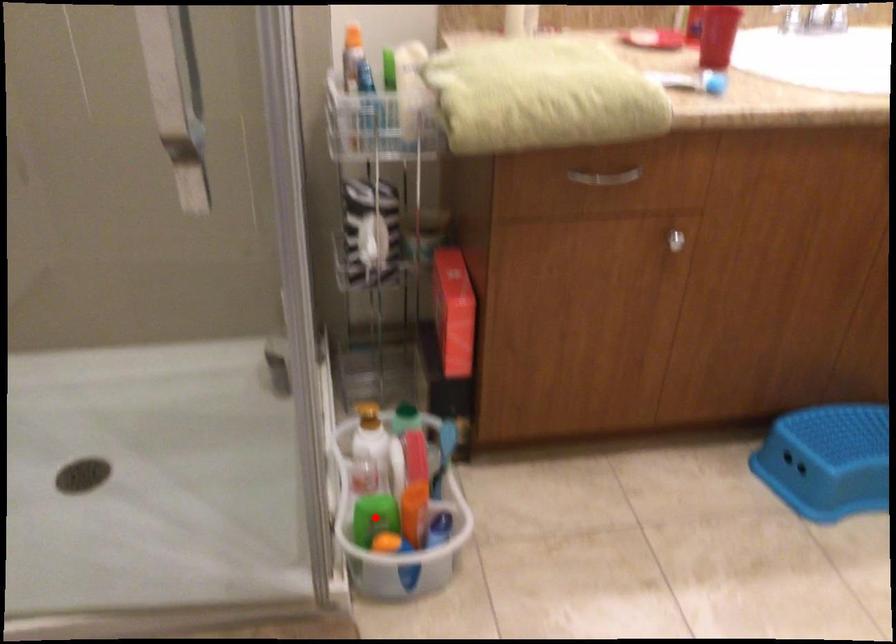
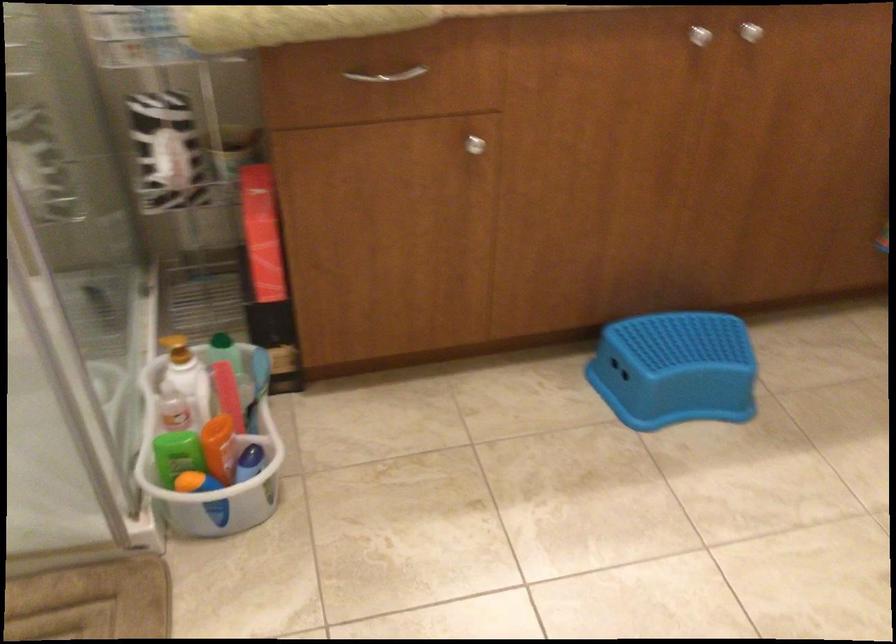
Locate, in the second image, the point that corresponds to the highlighted location in the first image.

(177, 453)